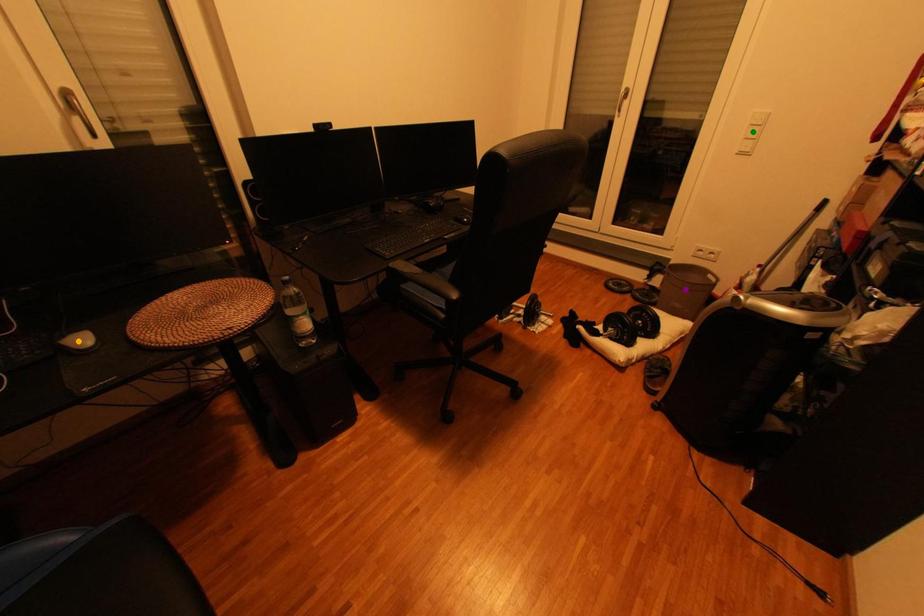
Order these from nearest to farthest:
green point | purple point | orange point

orange point < green point < purple point